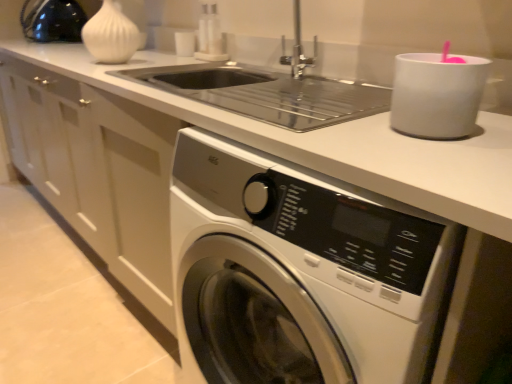
You are a GUI agent. You are given a task and a screenshot of the screen. Output one action in this format:
    pyautogui.click(x=<x>, y=<y>)
    Task: Click on the vacant space situated on the left part of white matte cup at upper right, the 2th appliance from the top
    The width and height of the screenshot is (512, 384).
    Given the screenshot: What is the action you would take?
    pyautogui.click(x=329, y=126)